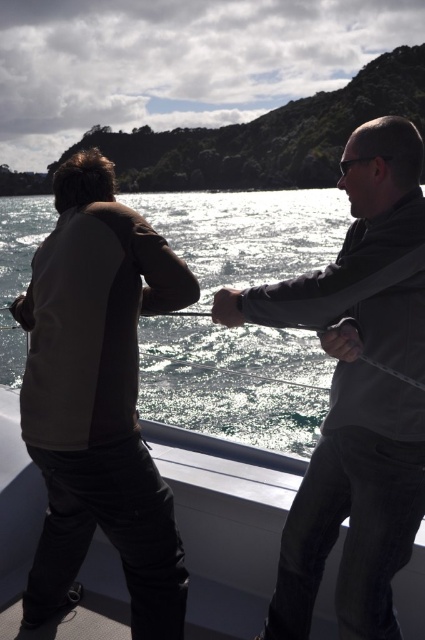
Question: Which point is farther to the camera?

Choices:
 (A) white glossy boat at lower center
 (B) brown leather jacket at left

Answer: (A)

Question: Which point is farther to the camera?

Choices:
 (A) (203, 408)
 (B) (238, 572)
 (C) (116, 230)
 (D) (317, 586)

Answer: (A)

Question: Can you confirm if white glossy boat at lower center is positioned to the left of metallic rod at center?

Choices:
 (A) yes
 (B) no

Answer: (B)

Question: Which is nearer to the brown leather jacket at left?

Choices:
 (A) metallic rod at center
 (B) glistening water at center
 (C) dark gray fabric jacket at right
 (D) white glossy boat at lower center

Answer: (C)

Question: Considering the relative positions of brown leather jacket at left and glistening water at center in the image provided, where is brown leather jacket at left located with respect to glistening water at center?

Choices:
 (A) left
 (B) right

Answer: (B)

Question: Is glistening water at center smaller than metallic rod at center?

Choices:
 (A) no
 (B) yes

Answer: (A)